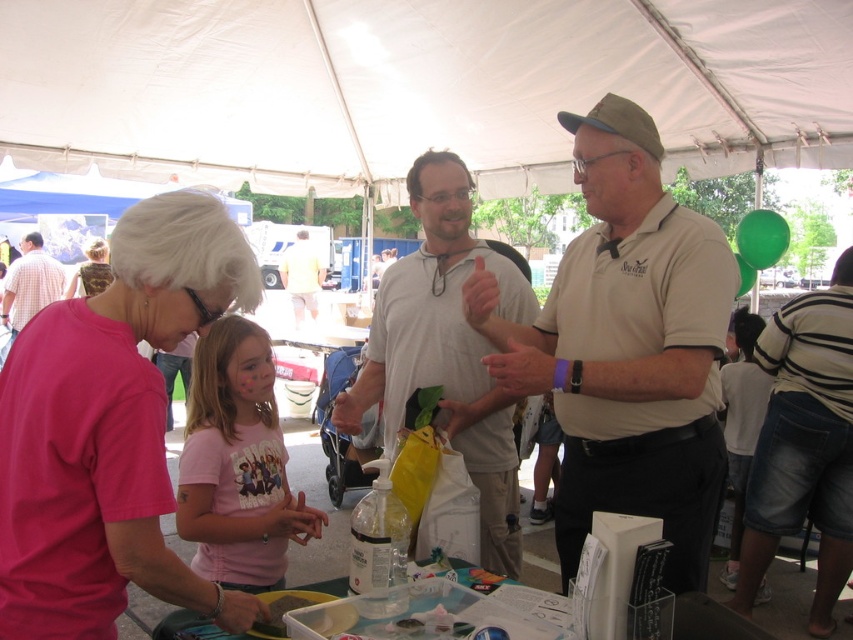
Question: Which point is closer to the camera?

Choices:
 (A) pink fabric shirt at upper left
 (B) striped shirt at center
 (C) camouflage fabric backpack at upper left
 (D) pink cotton shirt at center

Answer: (A)

Question: Is pink cotton shirt at center to the left of plaid cotton shirt at left from the viewer's perspective?

Choices:
 (A) no
 (B) yes

Answer: (A)

Question: Considering the relative positions of pink cotton shirt at center and camouflage fabric backpack at upper left in the image provided, where is pink cotton shirt at center located with respect to camouflage fabric backpack at upper left?

Choices:
 (A) below
 (B) above

Answer: (A)

Question: Which of the following is the farthest from the observer?

Choices:
 (A) (93, 241)
 (B) (294, 243)

Answer: (B)

Question: Can you confirm if striped shirt at center is positioned to the left of plaid cotton shirt at left?

Choices:
 (A) yes
 (B) no

Answer: (B)

Question: Which point is farther to the camera?

Choices:
 (A) (297, 308)
 (B) (483, 339)
 (C) (679, 115)
 (D) (57, 284)

Answer: (A)